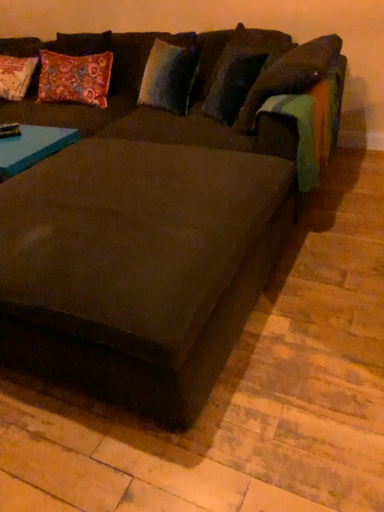
The image size is (384, 512). I want to click on velvety brown pillow at upper right, the 1th pillow from the right, so click(241, 70).

This screenshot has height=512, width=384. Identify the location of suede-like dark brown couch at center. (155, 225).

Describe the element at coordinates (155, 225) in the screenshot. I see `suede-like dark brown couch at center` at that location.

This screenshot has height=512, width=384. I want to click on velvety brown pillow at upper right, which ranks as the second pillow in left-to-right order, so click(241, 70).

Can you confirm if velvety blue pillow at upper center, positioned as the 1th pillow in left-to-right order, is smaller than velvety brown pillow at upper right, the 1th pillow from the right?

Yes, velvety blue pillow at upper center, positioned as the 1th pillow in left-to-right order, is smaller than velvety brown pillow at upper right, the 1th pillow from the right.

Is velvety blue pillow at upper center, positioned as the 1th pillow in left-to-right order, situated inside velvety brown pillow at upper right, the 1th pillow from the right, or outside?

The correct answer is: outside.

From the image's perspective, is velvety blue pillow at upper center, positioned as the 1th pillow in left-to-right order, located above velvety brown pillow at upper right, the 1th pillow from the right?

Indeed, from the image's perspective, velvety blue pillow at upper center, positioned as the 1th pillow in left-to-right order, is shown above velvety brown pillow at upper right, the 1th pillow from the right.

Consider the image. Considering the positions of objects velvety blue pillow at upper center, positioned as the 1th pillow in left-to-right order, and velvety brown pillow at upper right, the 1th pillow from the right, in the image provided, who is more to the right, velvety blue pillow at upper center, positioned as the 1th pillow in left-to-right order, or velvety brown pillow at upper right, the 1th pillow from the right,?

Positioned to the right is velvety brown pillow at upper right, the 1th pillow from the right.

From a real-world perspective, between velvety blue pillow at upper center, positioned as the 1th pillow in left-to-right order, and suede-like dark brown couch at center, who is vertically lower?

suede-like dark brown couch at center, from a real-world perspective.

Looking at this image, is suede-like dark brown couch at center at the back of velvety blue pillow at upper center, positioned as the 1th pillow in left-to-right order?

Correct, velvety blue pillow at upper center, positioned as the 1th pillow in left-to-right order, is looking away from suede-like dark brown couch at center.

Is velvety blue pillow at upper center, arranged as the second pillow when viewed from the right, located outside suede-like dark brown couch at center?

No, velvety blue pillow at upper center, arranged as the second pillow when viewed from the right, is not outside of suede-like dark brown couch at center.

Considering their positions, is suede-like dark brown couch at center located in front of or behind velvety blue pillow at upper center, positioned as the 1th pillow in left-to-right order?

suede-like dark brown couch at center is positioned closer to the viewer than velvety blue pillow at upper center, positioned as the 1th pillow in left-to-right order.

In terms of height, does suede-like dark brown couch at center look taller or shorter compared to velvety blue pillow at upper center, positioned as the 1th pillow in left-to-right order?

In the image, suede-like dark brown couch at center appears to be taller than velvety blue pillow at upper center, positioned as the 1th pillow in left-to-right order.

How many degrees apart are the facing directions of suede-like dark brown couch at center and velvety blue pillow at upper center, positioned as the 1th pillow in left-to-right order?

There is a 20-degree angle between the facing directions of suede-like dark brown couch at center and velvety blue pillow at upper center, positioned as the 1th pillow in left-to-right order.

From the image's perspective, which one is positioned lower, suede-like dark brown couch at center or velvety blue pillow at upper center, positioned as the 1th pillow in left-to-right order?

suede-like dark brown couch at center is shown below in the image.

Consider the image. Can you tell me how much suede-like dark brown couch at center and velvety brown pillow at upper right, which ranks as the second pillow in left-to-right order, differ in facing direction?

The angular difference between suede-like dark brown couch at center and velvety brown pillow at upper right, which ranks as the second pillow in left-to-right order, is 36.2 degrees.

From a real-world perspective, is suede-like dark brown couch at center on velvety brown pillow at upper right, which ranks as the second pillow in left-to-right order?

Actually, suede-like dark brown couch at center is physically below velvety brown pillow at upper right, which ranks as the second pillow in left-to-right order, in the real world.

From the picture: From the image's perspective, is suede-like dark brown couch at center below velvety brown pillow at upper right, which ranks as the second pillow in left-to-right order?

Correct, suede-like dark brown couch at center appears lower than velvety brown pillow at upper right, which ranks as the second pillow in left-to-right order, in the image.

Does point (210, 199) appear closer or farther from the camera than point (263, 58)?

Point (210, 199) is positioned closer to the camera compared to point (263, 58).

Is velvety brown pillow at upper right, the 1th pillow from the right, further to the viewer compared to suede-like dark brown couch at center?

Yes, it is.

Is point (219, 112) positioned in front of point (1, 212)?

No, (219, 112) is behind (1, 212).

Identify the location of studio couch below the velvety brown pillow at upper right, which ranks as the second pillow in left-to-right order (from a real-world perspective). The height and width of the screenshot is (512, 384). (155, 225).

Is the depth of velvety brown pillow at upper right, which ranks as the second pillow in left-to-right order, less than that of velvety blue pillow at upper center, positioned as the 1th pillow in left-to-right order?

Yes, it is.

Could you tell me if velvety brown pillow at upper right, the 1th pillow from the right, is turned towards velvety blue pillow at upper center, arranged as the second pillow when viewed from the right?

No, velvety brown pillow at upper right, the 1th pillow from the right, is not turned towards velvety blue pillow at upper center, arranged as the second pillow when viewed from the right.

Considering the sizes of objects velvety brown pillow at upper right, the 1th pillow from the right, and velvety blue pillow at upper center, arranged as the second pillow when viewed from the right, in the image provided, who is wider, velvety brown pillow at upper right, the 1th pillow from the right, or velvety blue pillow at upper center, arranged as the second pillow when viewed from the right,?

Wider between the two is velvety brown pillow at upper right, the 1th pillow from the right.

Which object is positioned more to the right, velvety brown pillow at upper right, which ranks as the second pillow in left-to-right order, or velvety blue pillow at upper center, positioned as the 1th pillow in left-to-right order?

Positioned to the right is velvety brown pillow at upper right, which ranks as the second pillow in left-to-right order.

Find the location of a particular element. The image size is (384, 512). pillow that is on the right side of velvety blue pillow at upper center, arranged as the second pillow when viewed from the right is located at coordinates (241, 70).

Where is `the 2nd pillow above the suede-like dark brown couch at center (from the image's perspective)`? The width and height of the screenshot is (384, 512). the 2nd pillow above the suede-like dark brown couch at center (from the image's perspective) is located at coordinates (170, 74).

When comparing their distances from suede-like dark brown couch at center, does velvety brown pillow at upper right, which ranks as the second pillow in left-to-right order, or velvety blue pillow at upper center, arranged as the second pillow when viewed from the right, seem further?

velvety blue pillow at upper center, arranged as the second pillow when viewed from the right, is positioned further to the anchor suede-like dark brown couch at center.

Estimate the real-world distances between objects in this image. Which object is further from suede-like dark brown couch at center, velvety blue pillow at upper center, positioned as the 1th pillow in left-to-right order, or velvety brown pillow at upper right, which ranks as the second pillow in left-to-right order?

velvety blue pillow at upper center, positioned as the 1th pillow in left-to-right order.

Considering their positions, is suede-like dark brown couch at center positioned closer to velvety blue pillow at upper center, arranged as the second pillow when viewed from the right, than velvety brown pillow at upper right, which ranks as the second pillow in left-to-right order?

velvety brown pillow at upper right, which ranks as the second pillow in left-to-right order, lies closer to velvety blue pillow at upper center, arranged as the second pillow when viewed from the right, than the other object.

When comparing their distances from velvety brown pillow at upper right, the 1th pillow from the right, does suede-like dark brown couch at center or velvety blue pillow at upper center, arranged as the second pillow when viewed from the right, seem further?

suede-like dark brown couch at center.

Estimate the real-world distances between objects in this image. Which object is closer to velvety blue pillow at upper center, positioned as the 1th pillow in left-to-right order, velvety brown pillow at upper right, which ranks as the second pillow in left-to-right order, or suede-like dark brown couch at center?

The object closer to velvety blue pillow at upper center, positioned as the 1th pillow in left-to-right order, is velvety brown pillow at upper right, which ranks as the second pillow in left-to-right order.

Looking at the image, which one is located further to velvety brown pillow at upper right, which ranks as the second pillow in left-to-right order, velvety blue pillow at upper center, arranged as the second pillow when viewed from the right, or suede-like dark brown couch at center?

Based on the image, suede-like dark brown couch at center appears to be further to velvety brown pillow at upper right, which ranks as the second pillow in left-to-right order.

The height and width of the screenshot is (512, 384). I want to click on pillow between suede-like dark brown couch at center and velvety blue pillow at upper center, arranged as the second pillow when viewed from the right, in the front-back direction, so click(x=241, y=70).